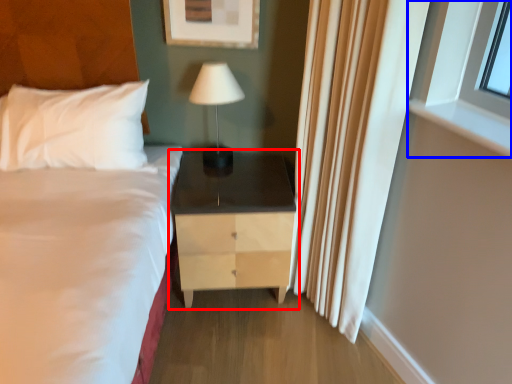
Question: Which of the following is the farthest to the observer, nightstand (highlighted by a red box) or window (highlighted by a blue box)?

Choices:
 (A) nightstand
 (B) window

Answer: (A)